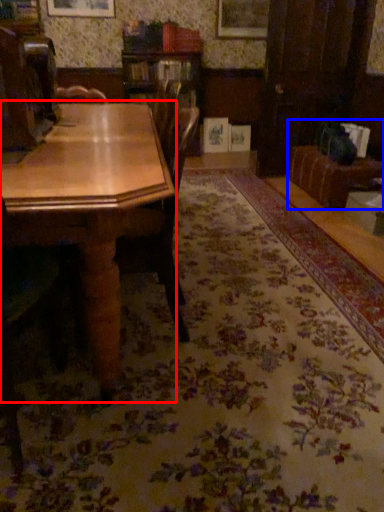
Question: Which object appears closest to the camera in this image, table (highlighted by a red box) or couch (highlighted by a blue box)?

Choices:
 (A) table
 (B) couch

Answer: (A)